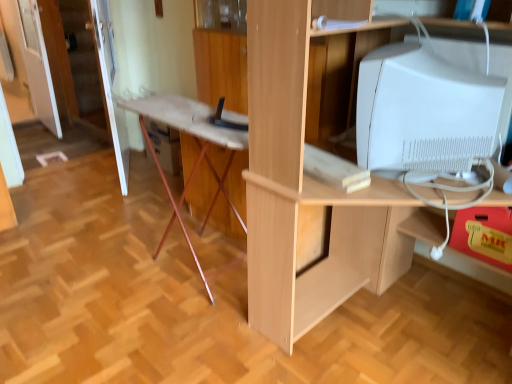
Identify the location of free region on the left part of wooden ironing board at center. (108, 267).